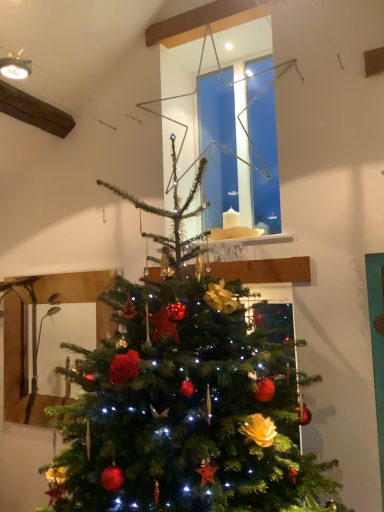
Image resolution: width=384 pixels, height=512 pixels. Identify the location of free space above metallic wire star at upper center (from a real-world perspective). (221, 22).